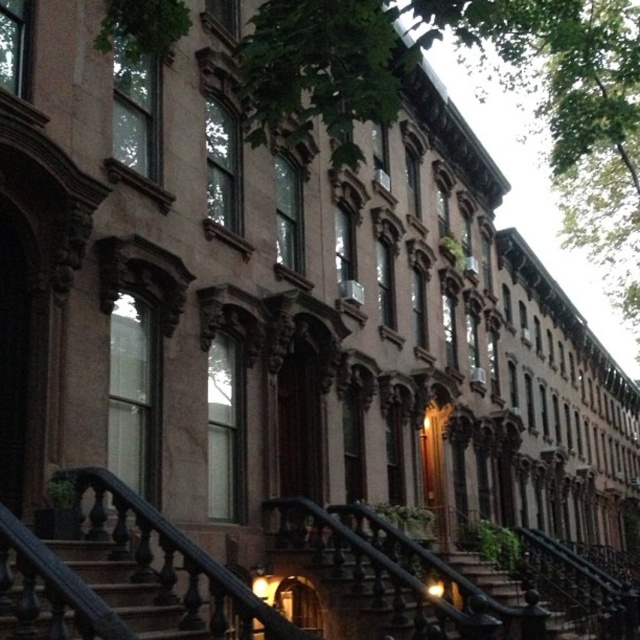
You are a delivery person trying to reach the entrance of the building. You see the dark brown wood stairs at lower left and the black wrought iron stairs at center. Which set of stairs should you take if you want to choose the one that is easier to climb?

The dark brown wood stairs at lower left has a smaller size compared to black wrought iron stairs at center, so they are easier to climb.

Looking at this image, you are standing at the bottom of the dark brown wood stairs at lower left and want to reach the entrance of the building. Do you need to go around the black wrought iron stairs at center to reach the entrance?

The dark brown wood stairs at lower left is in front of the black wrought iron stairs at center, so you can directly reach the entrance by taking the dark brown wood stairs at lower left without needing to go around the black wrought iron stairs at center.

You are a delivery person carrying a large package and need to choose between the dark brown wood stairs at lower left and the black wrought iron stairs at center. Which stairs have a wider path for carrying your package?

Answer: The black wrought iron stairs at center are wider than the dark brown wood stairs at lower left, so the black wrought iron stairs at center would provide a wider path for carrying the package.